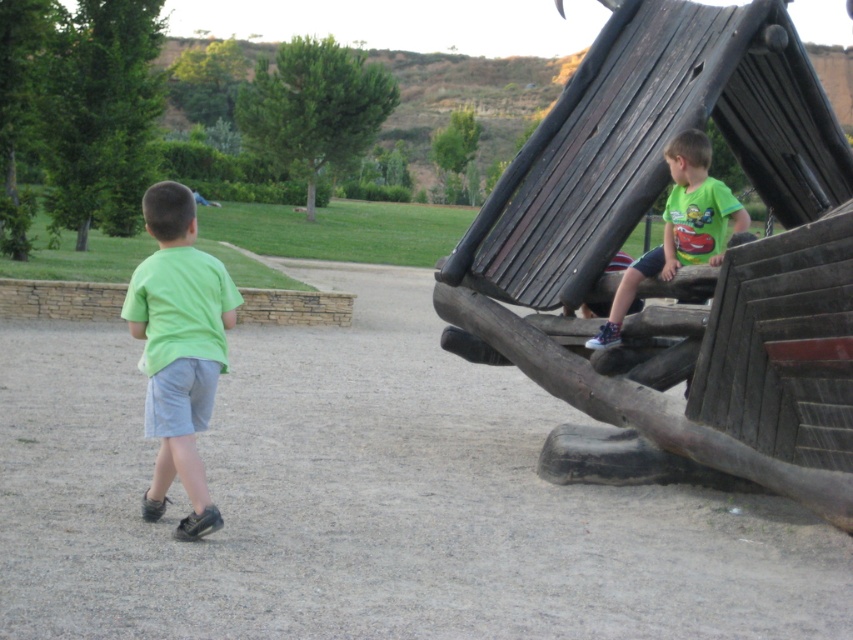
Question: Which of these objects is positioned farthest from the green matte shirt at left?

Choices:
 (A) wooden ship at right
 (B) green matte shirt at upper right

Answer: (A)

Question: Is green matte shirt at left below green matte shirt at upper right?

Choices:
 (A) yes
 (B) no

Answer: (A)

Question: Can you confirm if wooden ship at right is positioned above green matte shirt at upper right?

Choices:
 (A) no
 (B) yes

Answer: (B)

Question: Which point is farther to the camera?

Choices:
 (A) green matte shirt at upper right
 (B) wooden ship at right

Answer: (A)

Question: Does wooden ship at right have a lesser width compared to green matte shirt at upper right?

Choices:
 (A) yes
 (B) no

Answer: (B)

Question: Which point is farther to the camera?

Choices:
 (A) (701, 132)
 (B) (228, 307)

Answer: (A)